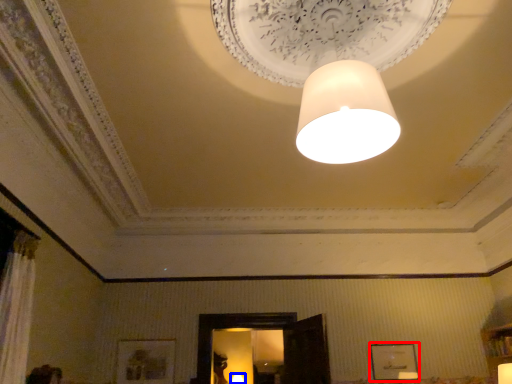
Question: Which point is closer to the camera, picture frame (highlighted by a red box) or lamp (highlighted by a blue box)?

Choices:
 (A) picture frame
 (B) lamp

Answer: (A)